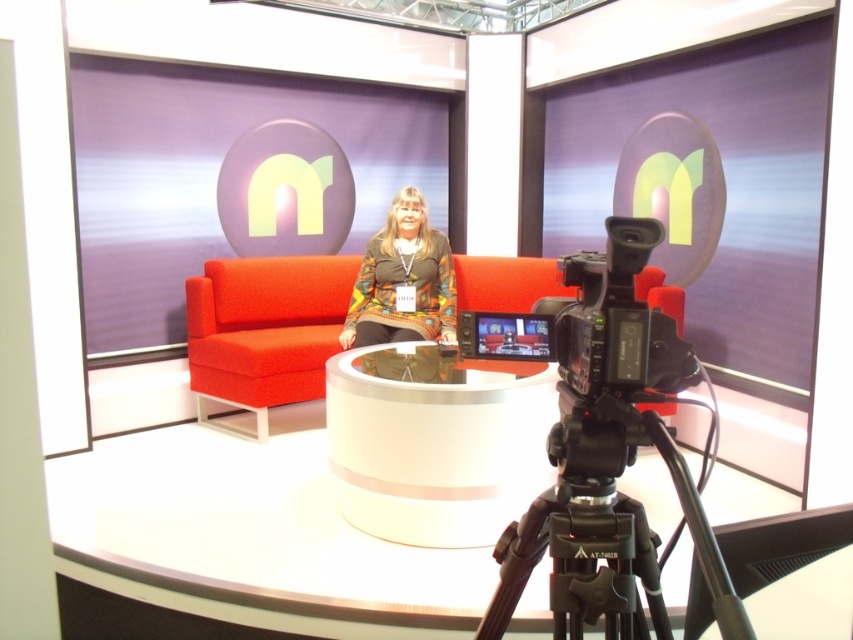
Question: Can you confirm if black plastic tripod at lower center is positioned to the left of velvet orange couch at center?

Choices:
 (A) yes
 (B) no

Answer: (B)

Question: In this image, where is black plastic tripod at lower center located relative to knitted sweater at center?

Choices:
 (A) below
 (B) above

Answer: (A)

Question: Based on their relative distances, which object is nearer to the knitted sweater at center?

Choices:
 (A) black plastic tripod at lower center
 (B) velvet orange couch at center

Answer: (B)

Question: Estimate the real-world distances between objects in this image. Which object is farther from the velvet orange couch at center?

Choices:
 (A) black plastic tripod at lower center
 (B) knitted sweater at center

Answer: (A)

Question: Which point appears closest to the camera in this image?

Choices:
 (A) (355, 280)
 (B) (299, 371)
 (C) (650, 561)

Answer: (C)

Question: Can you confirm if black plastic tripod at lower center is positioned below knitted sweater at center?

Choices:
 (A) no
 (B) yes

Answer: (B)